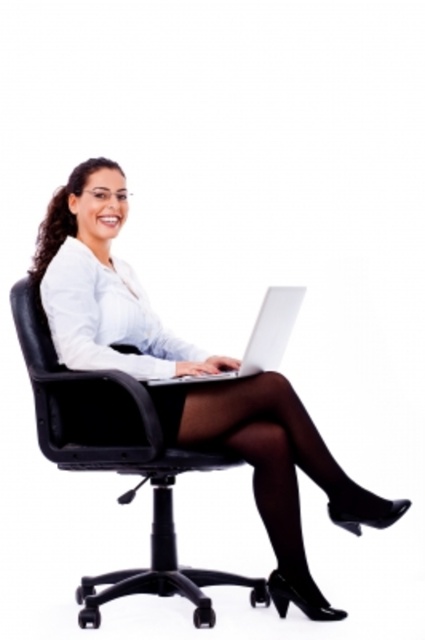
You are a delivery person who needs to place a box on the floor between the matte black laptop at center and the black leather swivel chair at center. Can you fit the box there if it measures 50 cm in length?

The black leather swivel chair at center is behind the matte black laptop at center, so there is no space between them for the box. The box cannot be placed there.